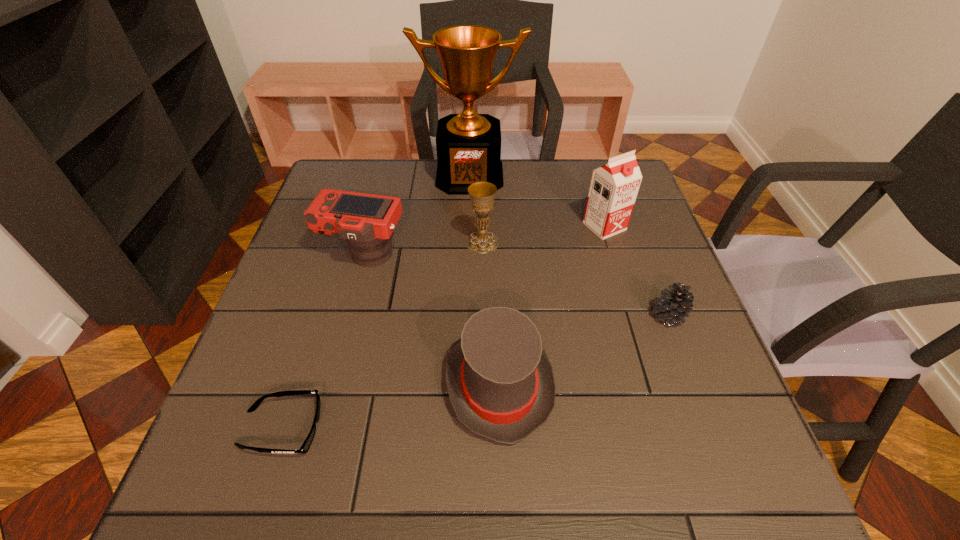
Where is `blank space located 0.090m on the front of the soya milk`? blank space located 0.090m on the front of the soya milk is located at coordinates (616, 265).

Locate an element on the screen. The width and height of the screenshot is (960, 540). vacant area situated 0.100m on the right of the chalice is located at coordinates (538, 242).

Locate an element on the screen. The image size is (960, 540). free space located on the right of the camera is located at coordinates (450, 254).

The width and height of the screenshot is (960, 540). In order to click on vacant area located on the right of the dress hat in this screenshot , I will do `click(615, 386)`.

Image resolution: width=960 pixels, height=540 pixels. I want to click on vacant space located 0.210m on the front of the pinecone, so click(x=708, y=425).

Image resolution: width=960 pixels, height=540 pixels. I want to click on blank space located 0.150m on the front-facing side of the sunglasses, so click(405, 429).

This screenshot has height=540, width=960. What are the coordinates of `object located at the far edge` in the screenshot? It's located at (468, 145).

This screenshot has height=540, width=960. Find the location of `object present at the near edge`. object present at the near edge is located at coordinates click(x=304, y=448).

What are the coordinates of `camera present at the left edge` in the screenshot? It's located at (366, 221).

Find the location of a particular element. The width and height of the screenshot is (960, 540). sunglasses situated at the left edge is located at coordinates (304, 448).